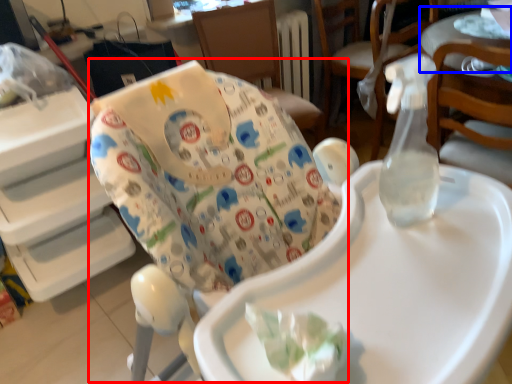
Question: Which object appears closest to the camera in this image, rocking chair (highlighted by a red box) or table (highlighted by a blue box)?

Choices:
 (A) rocking chair
 (B) table

Answer: (A)